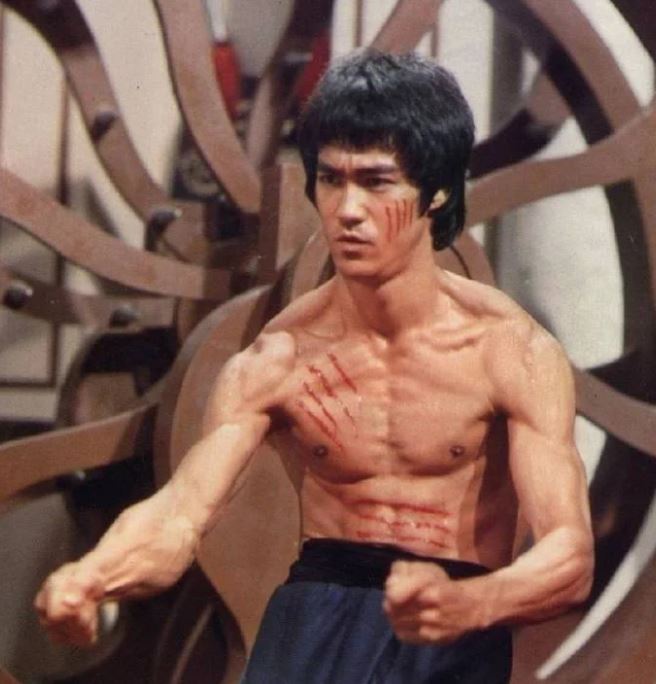
Where is `chest`? The height and width of the screenshot is (684, 656). chest is located at coordinates (359, 419), (426, 415).